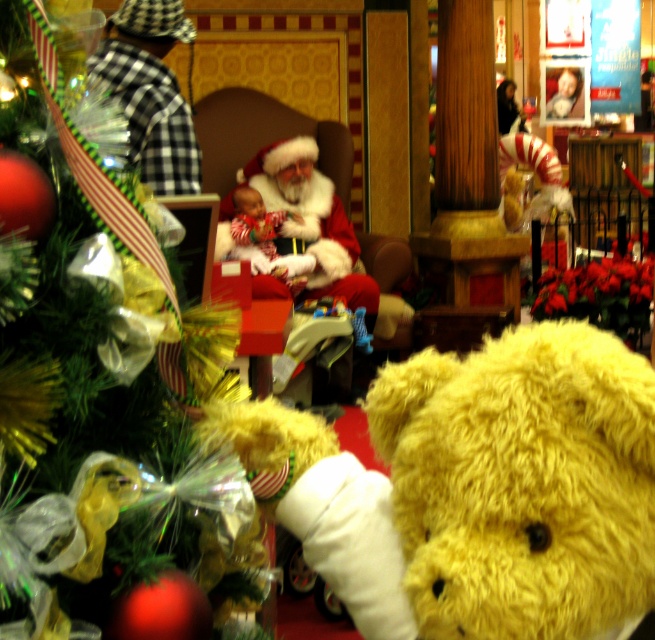
Question: Which point is farther to the camera?

Choices:
 (A) (346, 278)
 (B) (100, 568)
 (C) (464, 436)

Answer: (A)

Question: Based on their relative distances, which object is nearer to the yellow plush bear at center?

Choices:
 (A) fuzzy red santa at center
 (B) soft plush baby at center

Answer: (A)

Question: Estimate the real-world distances between objects in this image. Which object is farther from the shiny green tinsel at left?

Choices:
 (A) soft plush baby at center
 (B) fuzzy red santa at center

Answer: (A)

Question: Does shiny green tinsel at left appear on the right side of soft plush baby at center?

Choices:
 (A) no
 (B) yes

Answer: (B)

Question: Is shiny green tinsel at left closer to camera compared to soft plush baby at center?

Choices:
 (A) no
 (B) yes

Answer: (B)

Question: From the image, what is the correct spatial relationship of shiny green tinsel at left in relation to soft plush baby at center?

Choices:
 (A) above
 (B) below

Answer: (B)